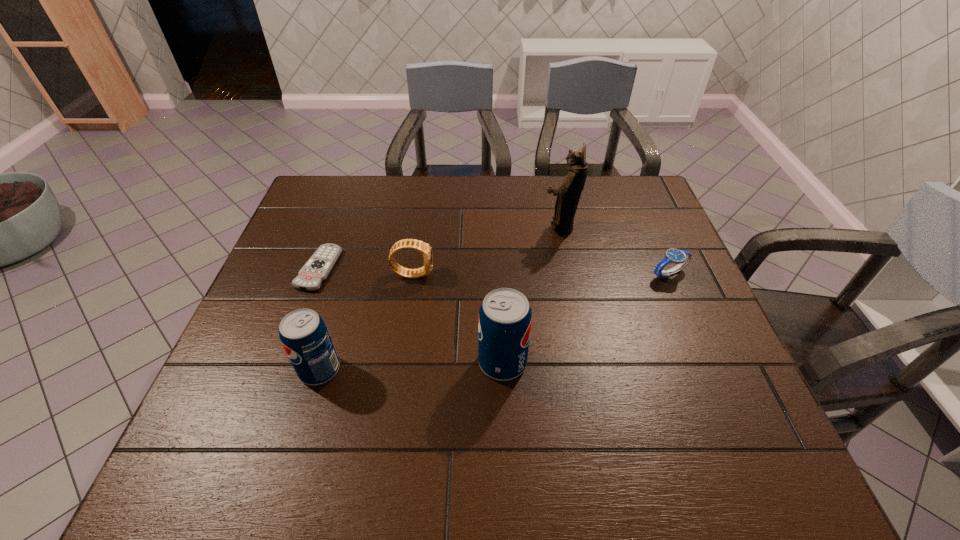
The width and height of the screenshot is (960, 540). I want to click on vacant region that satisfies the following two spatial constraints: 1. on the front-facing side of the tallest object; 2. on the front side of the second tallest object, so click(587, 362).